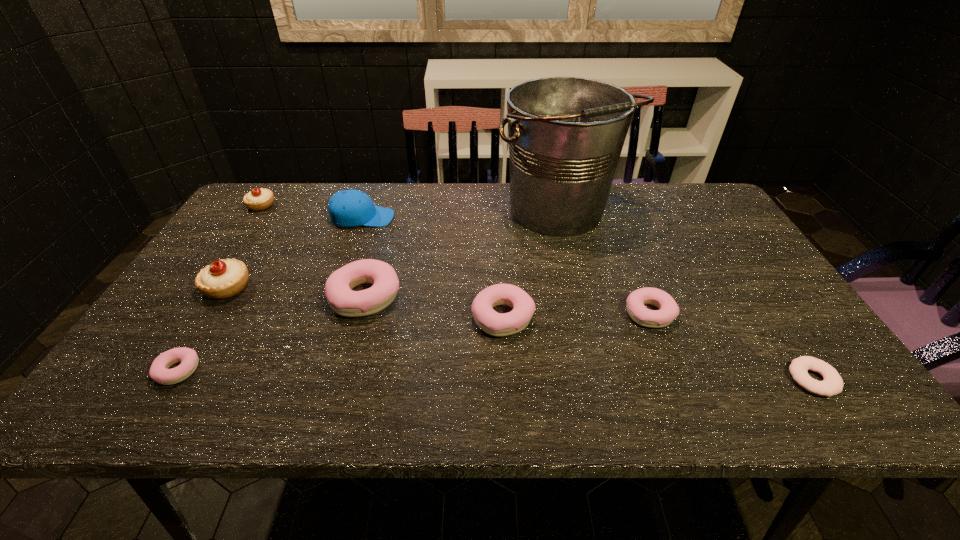
Where is `the tallest object`? This screenshot has width=960, height=540. the tallest object is located at coordinates (566, 134).

The image size is (960, 540). I want to click on blue cap, so click(x=347, y=208).

Where is `the nearer beige pastry`? Image resolution: width=960 pixels, height=540 pixels. the nearer beige pastry is located at coordinates (225, 278).

Where is `the bigger beige pastry`? The image size is (960, 540). the bigger beige pastry is located at coordinates (225, 278).

This screenshot has height=540, width=960. Find the location of `the farthest pastry`. the farthest pastry is located at coordinates (258, 199).

This screenshot has width=960, height=540. In order to click on the farther beige pastry in this screenshot , I will do pos(258,199).

This screenshot has width=960, height=540. In order to click on the third pink pastry from right to left in this screenshot , I will do `click(344, 301)`.

Where is `the biggest pink pastry`? the biggest pink pastry is located at coordinates (344, 301).

Identify the location of the fourth tallest pastry. The width and height of the screenshot is (960, 540). 496,324.

This screenshot has width=960, height=540. Identify the location of the sixth tallest object. (496, 324).